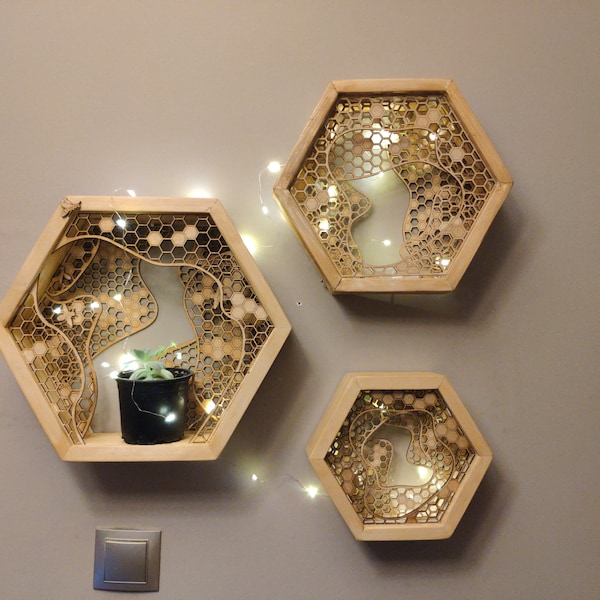
You are a GUI agent. You are given a task and a screenshot of the screen. Output one action in this format:
    pyautogui.click(x=<x>, y=<y>)
    Task: Click on the wall
    The height and width of the screenshot is (600, 600).
    Given the screenshot: What is the action you would take?
    pyautogui.click(x=224, y=84)